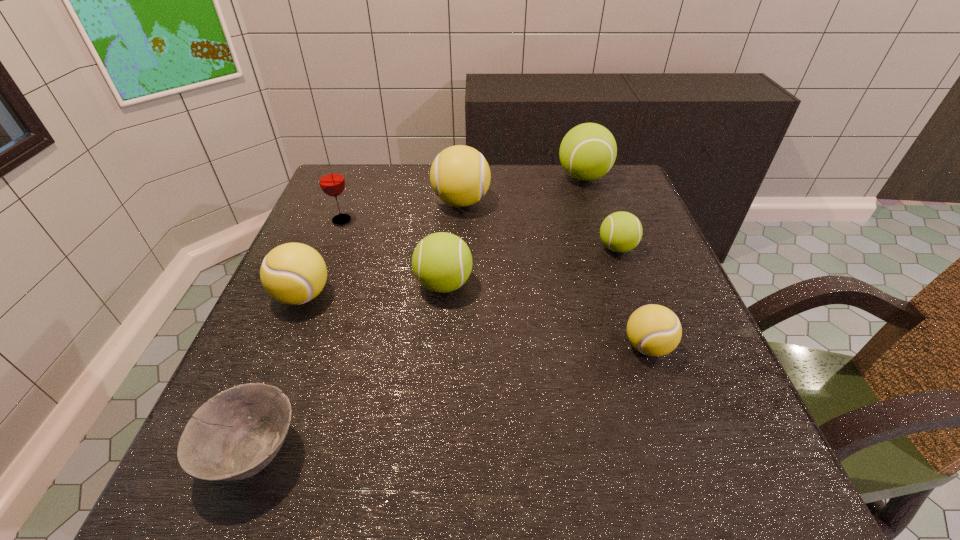
Locate an element on the screen. The height and width of the screenshot is (540, 960). vacant area at the left edge of the desktop is located at coordinates (352, 251).

The image size is (960, 540). Find the location of `free space at the right edge of the desktop`. free space at the right edge of the desktop is located at coordinates (669, 393).

Find the location of a particular element. The image size is (960, 540). vacant area at the far right corner is located at coordinates (612, 173).

In order to click on vacant space at the near right corner of the desktop in this screenshot , I will do `click(707, 477)`.

This screenshot has width=960, height=540. What are the coordinates of `empty space that is in between the third farthest tennis ball and the nearest object` in the screenshot? It's located at (435, 350).

Identify the location of vacant area between the bowl and the second farthest green tennis ball. [435, 350].

What are the coordinates of `free point between the second nearest yellow tennis ball and the glass` in the screenshot? It's located at (323, 258).

This screenshot has height=540, width=960. Find the location of `unoccupied area between the farthest yellow tennis ball and the farthest green tennis ball`. unoccupied area between the farthest yellow tennis ball and the farthest green tennis ball is located at coordinates (522, 190).

Image resolution: width=960 pixels, height=540 pixels. What are the coordinates of `empty location between the biggest green tennis ball and the nearest yellow tennis ball` in the screenshot? It's located at (615, 262).

You are a GUI agent. You are given a task and a screenshot of the screen. Output one action in this format:
    pyautogui.click(x=<x>, y=<y>)
    Task: Click on the vacant space that's between the leftmost green tennis ball and the leftmost yellow tennis ball
    The height and width of the screenshot is (540, 960).
    Given the screenshot: What is the action you would take?
    pyautogui.click(x=373, y=290)